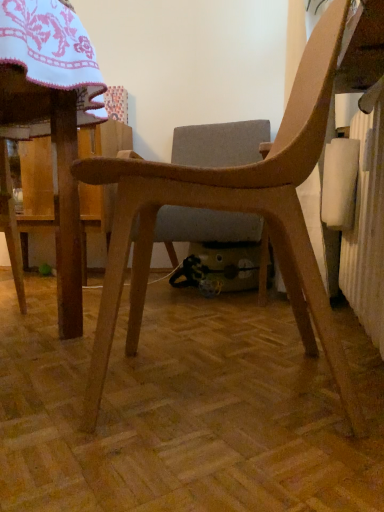
Image resolution: width=384 pixels, height=512 pixels. I want to click on vacant space behind wooden chair at center, so click(x=238, y=326).